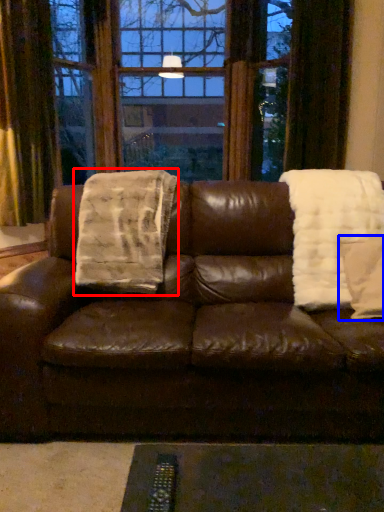
Question: Which object appears closest to the camera in this image, blanket (highlighted by a red box) or throw pillow (highlighted by a blue box)?

Choices:
 (A) blanket
 (B) throw pillow

Answer: (B)